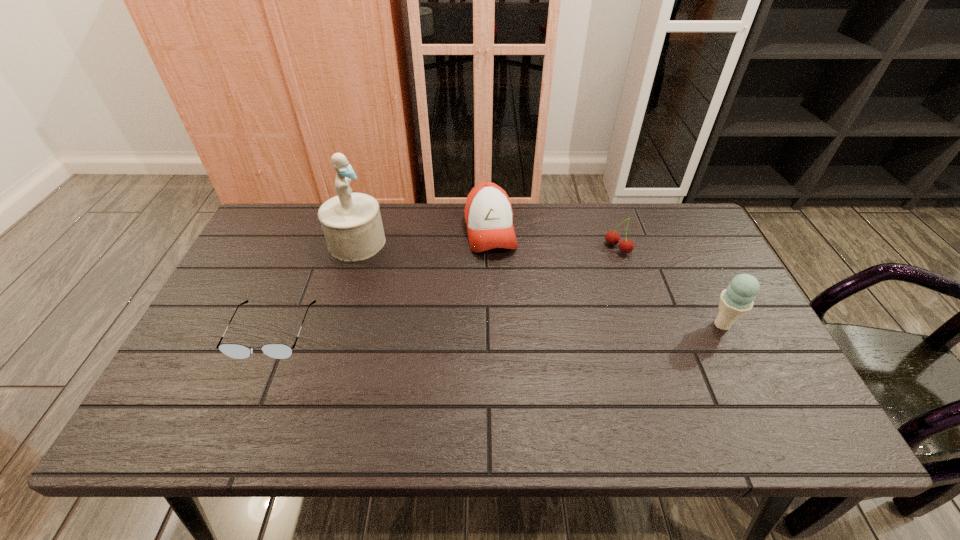
The height and width of the screenshot is (540, 960). Identify the location of vacant space on the desktop that is between the shortest object and the fourth shortest object and is positioned on the front-facing side of the third object from left to right. (514, 328).

What are the coordinates of `free space on the desktop that is between the shortest object and the rightmost object and is positioned at the beak of the figurine` in the screenshot? It's located at (503, 328).

I want to click on free space on the desktop that is between the spectacles and the fourth shortest object and is positioned on the surface of the second object from right to left, so click(479, 328).